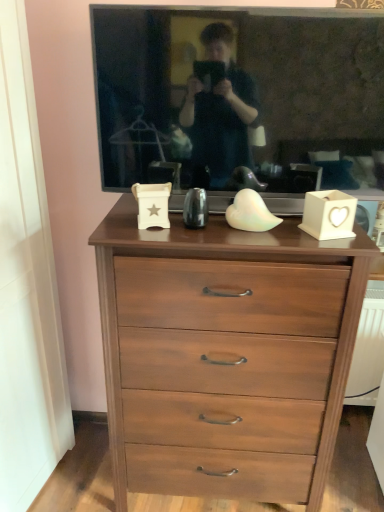
Describe the element at coordinates (225, 358) in the screenshot. I see `walnut wood chest of drawers at center` at that location.

What is the approximate width of walnut wood chest of drawers at center?

The width of walnut wood chest of drawers at center is 19.74 inches.

Identify the location of walnut wood chest of drawers at center. (225, 358).

What is the approximate height of walnut wood chest of drawers at center?

3.80 feet.

Image resolution: width=384 pixels, height=512 pixels. Identify the location of matte black tv at upper center. (240, 100).

Describe the element at coordinates (240, 100) in the screenshot. I see `matte black tv at upper center` at that location.

Identify the location of walnut wood chest of drawers at center. The height and width of the screenshot is (512, 384). (225, 358).

Considering the positions of objects matte black tv at upper center and walnut wood chest of drawers at center in the image provided, who is more to the left, matte black tv at upper center or walnut wood chest of drawers at center?

walnut wood chest of drawers at center is more to the left.

Does matte black tv at upper center lie behind walnut wood chest of drawers at center?

No.

Considering the positions of points (158, 17) and (319, 357), is point (158, 17) farther from camera compared to point (319, 357)?

That is False.

From the image's perspective, which one is positioned lower, matte black tv at upper center or walnut wood chest of drawers at center?

From the image's view, walnut wood chest of drawers at center is below.

From a real-world perspective, does matte black tv at upper center sit lower than walnut wood chest of drawers at center?

No, from a real-world perspective, matte black tv at upper center is not below walnut wood chest of drawers at center.

Is matte black tv at upper center wider or thinner than walnut wood chest of drawers at center?

Considering their sizes, matte black tv at upper center looks slimmer than walnut wood chest of drawers at center.

Considering the sizes of objects matte black tv at upper center and walnut wood chest of drawers at center in the image provided, who is taller, matte black tv at upper center or walnut wood chest of drawers at center?

With more height is walnut wood chest of drawers at center.

Is matte black tv at upper center smaller than walnut wood chest of drawers at center?

Yes, matte black tv at upper center is smaller than walnut wood chest of drawers at center.

Is matte black tv at upper center surrounding walnut wood chest of drawers at center?

No, walnut wood chest of drawers at center is not inside matte black tv at upper center.

Would you say matte black tv at upper center is a long distance from walnut wood chest of drawers at center?

No, there isn't a large distance between matte black tv at upper center and walnut wood chest of drawers at center.

Is matte black tv at upper center facing towards walnut wood chest of drawers at center?

No, matte black tv at upper center does not turn towards walnut wood chest of drawers at center.

How much distance is there between matte black tv at upper center and walnut wood chest of drawers at center?

matte black tv at upper center and walnut wood chest of drawers at center are 18.74 inches apart from each other.

Identify the location of the chest of drawers behind the matte black tv at upper center. This screenshot has height=512, width=384. (225, 358).

In the scene shown: Does walnut wood chest of drawers at center appear on the right side of matte black tv at upper center?

No.

Which is in front, walnut wood chest of drawers at center or matte black tv at upper center?

matte black tv at upper center is more forward.

Which is behind, point (229, 302) or point (194, 30)?

The point (229, 302) is farther from the camera.

From the image's perspective, is walnut wood chest of drawers at center above or below matte black tv at upper center?

From the image's perspective, walnut wood chest of drawers at center appears below matte black tv at upper center.

From a real-world perspective, does walnut wood chest of drawers at center stand above matte black tv at upper center?

Incorrect, from a real-world perspective, walnut wood chest of drawers at center is lower than matte black tv at upper center.

Which of these two, walnut wood chest of drawers at center or matte black tv at upper center, is thinner?

matte black tv at upper center.

Is walnut wood chest of drawers at center taller than matte black tv at upper center?

Correct, walnut wood chest of drawers at center is much taller as matte black tv at upper center.

Between walnut wood chest of drawers at center and matte black tv at upper center, which one has larger size?

walnut wood chest of drawers at center.

Is matte black tv at upper center located within walnut wood chest of drawers at center?

No, matte black tv at upper center is not inside walnut wood chest of drawers at center.

Is walnut wood chest of drawers at center positioned far away from matte black tv at upper center?

No, walnut wood chest of drawers at center is not far from matte black tv at upper center.

Could you tell me if walnut wood chest of drawers at center is turned towards matte black tv at upper center?

No, walnut wood chest of drawers at center is not facing towards matte black tv at upper center.

This screenshot has width=384, height=512. I want to click on picture frame on the right of walnut wood chest of drawers at center, so click(240, 100).

This screenshot has width=384, height=512. I want to click on picture frame located above the walnut wood chest of drawers at center (from a real-world perspective), so click(x=240, y=100).

Locate an element on the screen. The height and width of the screenshot is (512, 384). chest of drawers on the left of matte black tv at upper center is located at coordinates (225, 358).